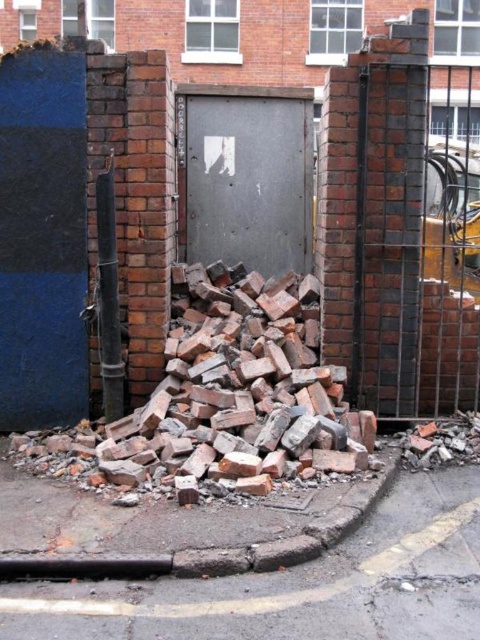
You are standing in the urban scene depicted. There is a point labeled as point (402, 225). Which object from the scene does this point belong to?

The point (402, 225) is on the brick fence at right.

You are a delivery person with a cart that is 1.5 meters wide. You need to move from the brick fence at right to the metallic gray door at center. Can your cart fit through the space between them?

The brick fence at right is 1.52 meters away from the metallic gray door at center. Since your cart is 1.5 meters wide, it can fit through the space between them as the distance is slightly larger than the cart.

You are a delivery person trying to enter a construction site. You see a brick fence at right and a metallic gray door at center. Which object is higher from the ground?

The brick fence at right is above the metallic gray door at center, so the brick fence at right is higher from the ground.